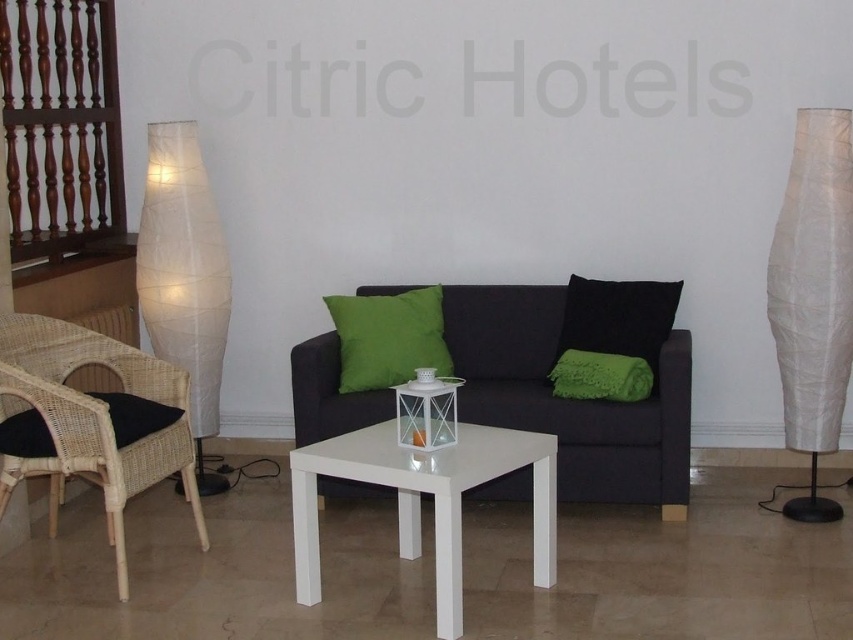
From the picture: Between black fabric couch at center and woven rattan armchair at left, which one has more height?

black fabric couch at center is taller.

Is black fabric couch at center to the right of woven rattan armchair at left from the viewer's perspective?

Indeed, black fabric couch at center is positioned on the right side of woven rattan armchair at left.

Between point (672, 292) and point (48, 440), which one is positioned behind?

The point (672, 292) is more distant.

The width and height of the screenshot is (853, 640). I want to click on black fabric couch at center, so click(x=579, y=400).

Which is more to the left, white glossy table at center or black matte pillow at center?

white glossy table at center

Does white glossy table at center appear over black matte pillow at center?

No.

Does point (297, 600) lie in front of point (614, 282)?

Yes.

This screenshot has width=853, height=640. In order to click on white glossy table at center in this screenshot , I will do `click(419, 499)`.

Who is positioned more to the right, black matte pillow at center or green textured blanket at right?

black matte pillow at center

Locate an element on the screen. black matte pillow at center is located at coordinates (619, 317).